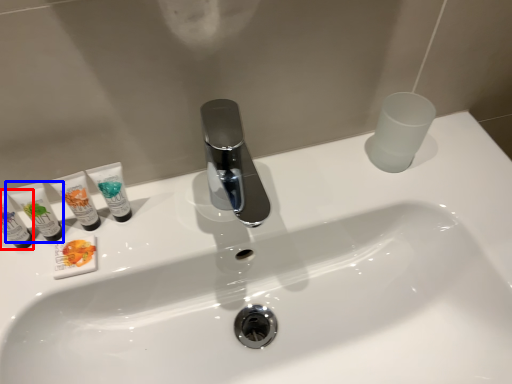
Question: Which object is closer to the camera taking this photo, toiletry (highlighted by a red box) or toiletry (highlighted by a blue box)?

Choices:
 (A) toiletry
 (B) toiletry

Answer: (A)